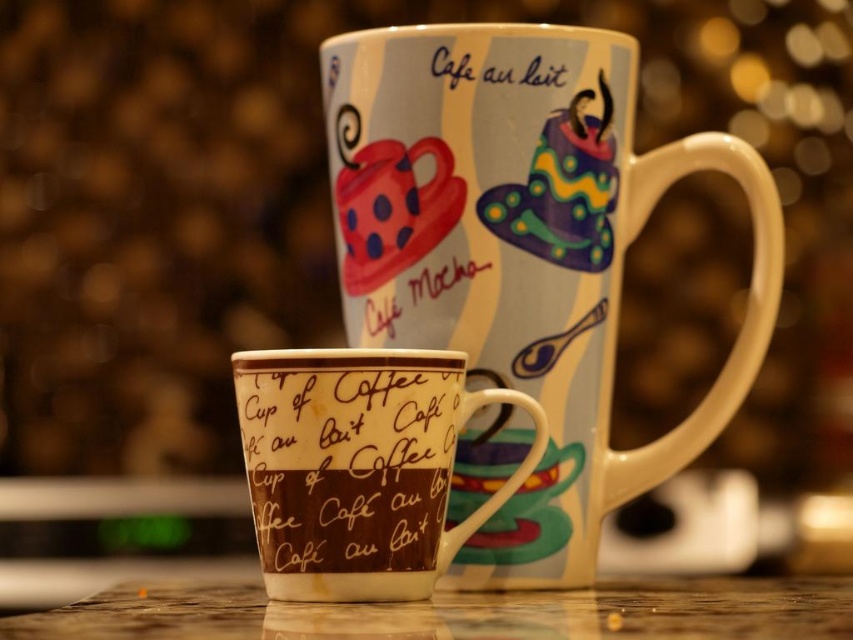
What object is located at the coordinates point (347, 464) in the image?

The point (347, 464) marks the brown matte cup of coffee at center.

You are looking at the scene and want to know if the brown matte cup of coffee at center is located below the matte white text at upper center. Can you confirm this?

The brown matte cup of coffee at center is positioned under matte white text at upper center, so yes, the brown matte cup of coffee at center is located below the matte white text at upper center.

You are trying to place a new sticker on the wooden table between the brown matte cup of coffee at center and the matte white text at upper center. Can you fit it there if the sticker is 10 cm wide?

The brown matte cup of coffee at center is positioned on the left side of matte white text at upper center, so there is space between them. The sticker can be placed there as long as the distance between the two objects is at least 10 cm. However, the exact distance isn t provided, so we can t confirm for sure without measuring.